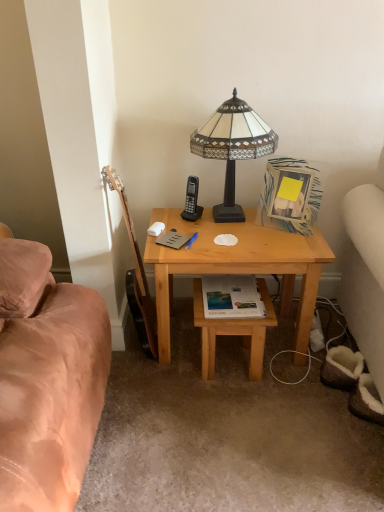
At what (x,y) coordinates should I click in order to perform the action: click on vacant area located to the right-hand side of light brown wooden stool at lower center. Please return your answer as a coordinate pair (x, y). The width and height of the screenshot is (384, 512). Looking at the image, I should click on (298, 369).